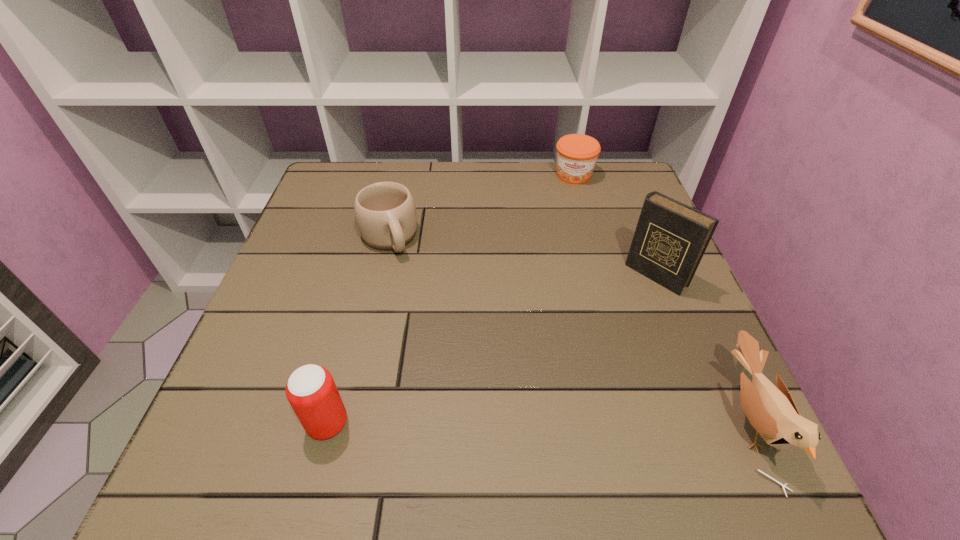
Identify the location of free spot between the beer can and the farthest object. This screenshot has height=540, width=960. (450, 299).

This screenshot has height=540, width=960. I want to click on empty space between the bird and the farthest object, so click(662, 298).

Where is `vacant region between the mug and the beer can`? The height and width of the screenshot is (540, 960). vacant region between the mug and the beer can is located at coordinates (358, 330).

Locate an element on the screen. vacant space in between the jam and the bird is located at coordinates (662, 298).

The image size is (960, 540). What are the coordinates of `free space that is in between the farthest object and the diary` in the screenshot? It's located at (615, 225).

You are a GUI agent. You are given a task and a screenshot of the screen. Output one action in this format:
    pyautogui.click(x=<x>, y=<y>)
    Task: Click on the empty space that is in between the third object from right to left and the bird
    The height and width of the screenshot is (540, 960).
    Given the screenshot: What is the action you would take?
    pyautogui.click(x=662, y=298)

Select which object is the fourth closest to the diary. Please provide its 2D coordinates. Your answer should be formatted as a tuple, i.e. [(x, y)], where the tuple contains the x and y coordinates of a point satisfying the conditions above.

[(311, 391)]

The height and width of the screenshot is (540, 960). I want to click on the second closest object to the bird, so click(x=577, y=154).

At what (x,y) coordinates should I click in order to perform the action: click on free space that satisfies the following two spatial constraints: 1. on the back side of the bird; 2. at the beak of the beer can. Please return your answer as a coordinate pair (x, y). Looking at the image, I should click on (328, 421).

You are a GUI agent. You are given a task and a screenshot of the screen. Output one action in this format:
    pyautogui.click(x=<x>, y=<y>)
    Task: Click on the vacant area that satisfies the following two spatial constraints: 1. on the front side of the bird; 2. at the beak of the mug
    The image size is (960, 540).
    Given the screenshot: What is the action you would take?
    pyautogui.click(x=347, y=421)